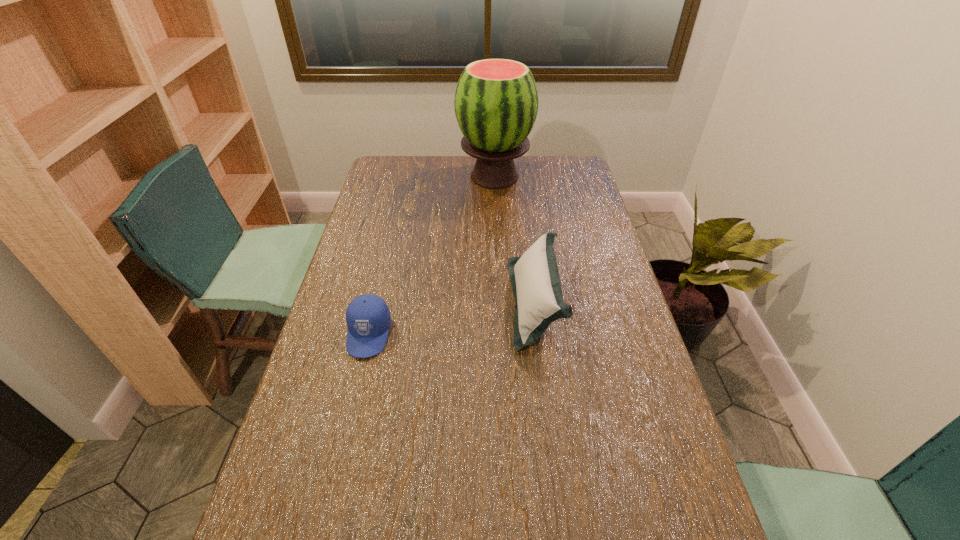
Where is `object at the far edge`? This screenshot has height=540, width=960. object at the far edge is located at coordinates (496, 101).

The width and height of the screenshot is (960, 540). I want to click on object present at the left edge, so click(x=368, y=319).

Identify the location of free space at the far edge of the desktop. (422, 177).

In order to click on free space at the left edge of the desktop in this screenshot , I will do pos(379,188).

Find the location of `free space at the right edge`. free space at the right edge is located at coordinates (699, 532).

What are the coordinates of `vacant area at the far left corner` in the screenshot? It's located at [380, 171].

This screenshot has height=540, width=960. Identify the location of free space that is in between the tallest object and the second shortest object. (515, 240).

Identify the location of free space between the tallest object and the second tallest object. (515, 240).

You are a GUI agent. You are given a task and a screenshot of the screen. Output one action in this format:
    pyautogui.click(x=<x>, y=<y>)
    Task: Click on the empty location between the shortest object and the watermelon
    
    Given the screenshot: What is the action you would take?
    pyautogui.click(x=432, y=255)

The height and width of the screenshot is (540, 960). In order to click on vacant area that lies between the cushion and the tallest object in this screenshot , I will do `click(515, 240)`.